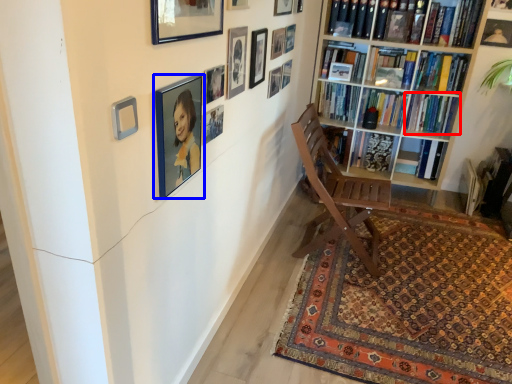
Question: Which object appears farthest to the camera in this image, book (highlighted by a red box) or picture frame (highlighted by a blue box)?

Choices:
 (A) book
 (B) picture frame

Answer: (A)